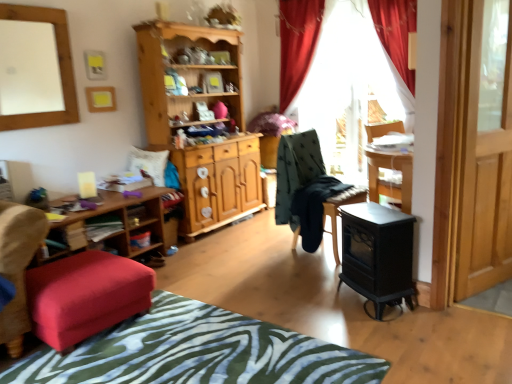
The image size is (512, 384). Identify the location of free space underneath transparent glass door at right (from a real-world perspective). (488, 281).